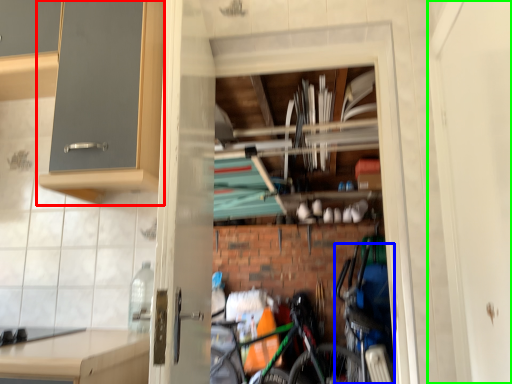
Question: Which object is the farthest from cabinetry (highlighted by a red box)? Choose among these: bicycle (highlighted by a blue box) or screen door (highlighted by a green box).

Choices:
 (A) bicycle
 (B) screen door

Answer: (A)